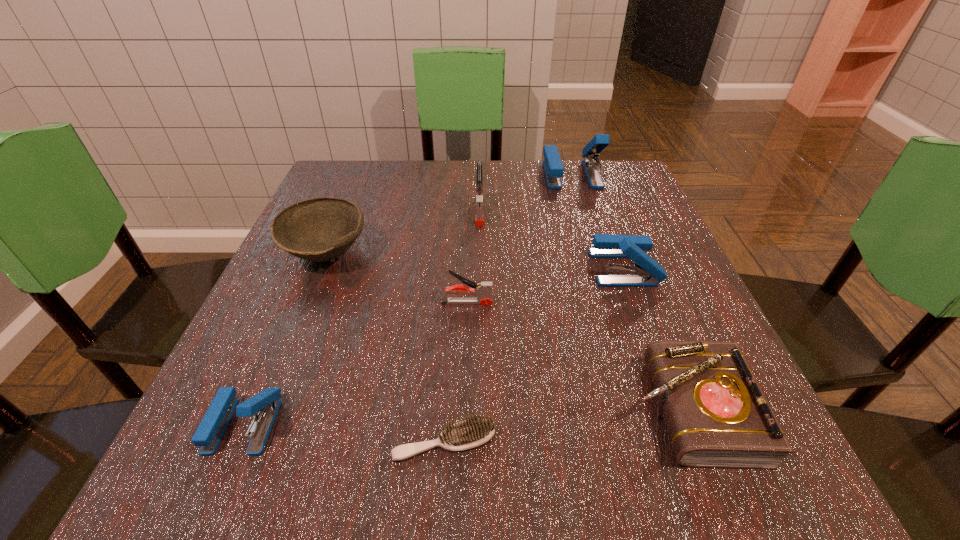
Where is `vacant point located between the shortest object and the farthest object`? vacant point located between the shortest object and the farthest object is located at coordinates (508, 308).

At what (x,y) coordinates should I click in order to perform the action: click on vacant area that lies between the leftmost blue stapler and the second farthest blue stapler. Please return your answer as a coordinate pair (x, y). Looking at the image, I should click on coord(434,346).

Where is `vacant point located between the scrubbing brush and the nearer gray stapler`? vacant point located between the scrubbing brush and the nearer gray stapler is located at coordinates (456, 372).

This screenshot has height=540, width=960. I want to click on free space between the farthest stapler and the scrubbing brush, so (508, 308).

At what (x,y) coordinates should I click in order to perform the action: click on object that ranks as the sixth closest to the leftmost blue stapler. Please return your answer as a coordinate pair (x, y). The image size is (960, 540). Looking at the image, I should click on point(646,272).

Locate which object is the closest to the farthest blue stapler. Please provide its 2D coordinates. Your answer should be formatted as a tuple, i.e. [(x, y)], where the tuple contains the x and y coordinates of a point satisfying the conditions above.

[(479, 217)]

You are a GUI agent. You are given a task and a screenshot of the screen. Output one action in this format:
    pyautogui.click(x=<x>, y=<y>)
    Task: Click on the second closest stapler to the shortest object
    
    Given the screenshot: What is the action you would take?
    pyautogui.click(x=483, y=290)

Image resolution: width=960 pixels, height=540 pixels. I want to click on stapler that stands as the second closest to the shortest object, so click(483, 290).

Identify which blue stapler is the third nearest to the scrubbing brush. Please provide its 2D coordinates. Your answer should be formatted as a tuple, i.e. [(x, y)], where the tuple contains the x and y coordinates of a point satisfying the conditions above.

[(553, 167)]

Locate an element on the screen. The height and width of the screenshot is (540, 960). blue stapler that is the second closest to the farthest stapler is located at coordinates (265, 404).